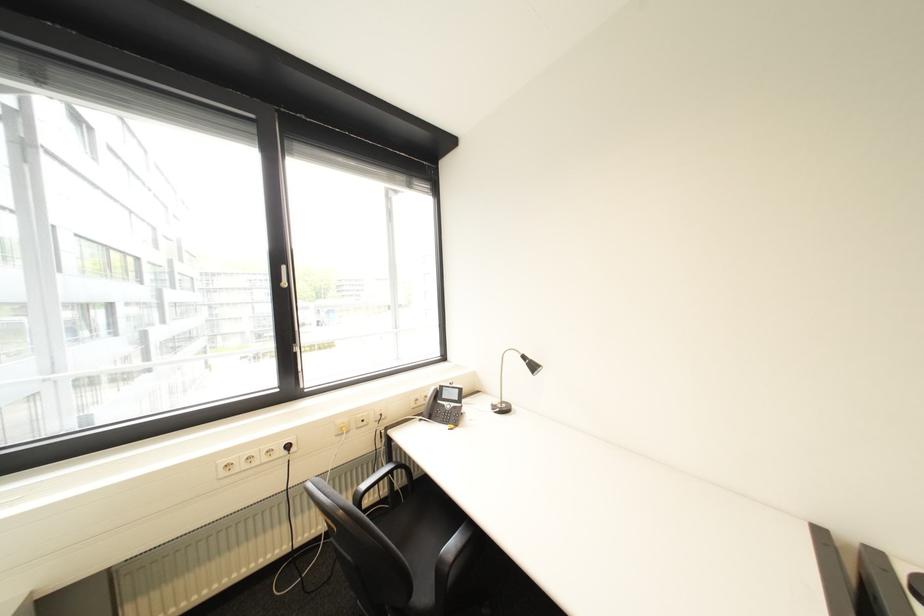
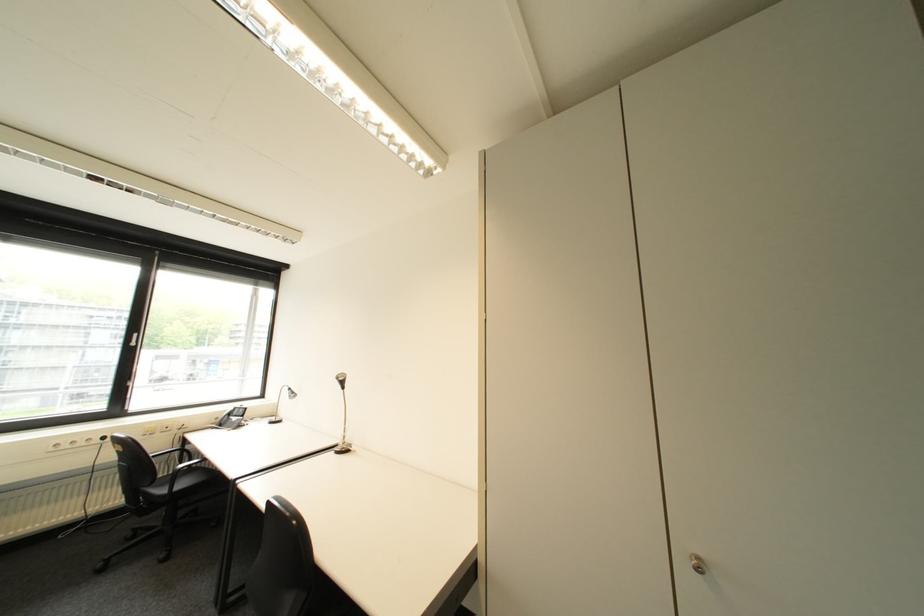
Where in the second image is the point corresponding to [298,447] from the first image?

(114, 439)